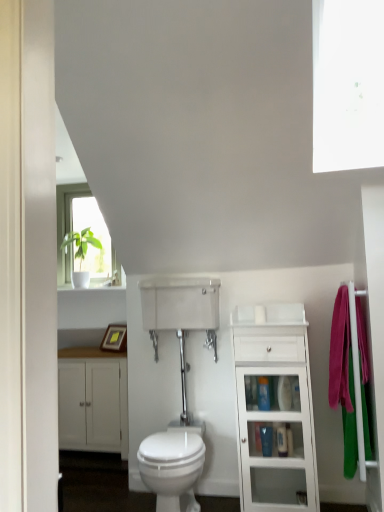
This screenshot has height=512, width=384. What do you see at coordinates (266, 440) in the screenshot?
I see `blue plastic bottle at center, the 2th toiletry viewed from the top` at bounding box center [266, 440].

What do you see at coordinates (348, 84) in the screenshot? This screenshot has height=512, width=384. I see `transparent glass window screen at upper right` at bounding box center [348, 84].

I want to click on white glossy medicine cabinet at center, so click(x=180, y=303).

What do you see at coordinates (172, 467) in the screenshot?
I see `white glossy bidet at center` at bounding box center [172, 467].

Image resolution: width=384 pixels, height=512 pixels. What do you see at coordinates (93, 400) in the screenshot? I see `white matte cabinet at lower left, placed as the 2th bathroom cabinet when sorted from front to back` at bounding box center [93, 400].

Identify the location of blue plastic bottle at center, the 2th toiletry viewed from the top. Image resolution: width=384 pixels, height=512 pixels. (266, 440).

Is point (332, 357) closer to viewer compared to point (173, 498)?

No, it is not.

From the image's perspective, which one is positioned lower, pink fabric towel at right or white glossy bidet at center?

white glossy bidet at center, from the image's perspective.

Could you tell me if pink fabric towel at right is turned towards white glossy bidet at center?

Yes, pink fabric towel at right is turned towards white glossy bidet at center.

From a real-world perspective, between blue plastic bottle at center, which is the first toiletry from bottom to top, and white glossy medicine cabinet at center, who is vertically higher?

white glossy medicine cabinet at center, from a real-world perspective.

Considering the sizes of objects blue plastic bottle at center, which is the first toiletry from bottom to top, and white glossy medicine cabinet at center in the image provided, who is smaller, blue plastic bottle at center, which is the first toiletry from bottom to top, or white glossy medicine cabinet at center?

blue plastic bottle at center, which is the first toiletry from bottom to top, is smaller.

Locate an element on the screen. The height and width of the screenshot is (512, 384). medicine cabinet behind the blue plastic bottle at center, the third toiletry from the top is located at coordinates (180, 303).

Can you confirm if blue plastic bottle at center, which is the first toiletry from bottom to top, is wider than white glossy medicine cabinet at center?

In fact, blue plastic bottle at center, which is the first toiletry from bottom to top, might be narrower than white glossy medicine cabinet at center.

Does blue plastic bottle at center, the third toiletry from the top, have a lesser width compared to white glossy cabinet at right, the first bathroom cabinet in the front-to-back sequence?

Indeed, blue plastic bottle at center, the third toiletry from the top, has a lesser width compared to white glossy cabinet at right, the first bathroom cabinet in the front-to-back sequence.

This screenshot has height=512, width=384. What are the coordinates of `bathroom cabinet in front of the blue plastic bottle at center, the third toiletry from the top` in the screenshot? It's located at (x=274, y=408).

Is white glossy cabinet at right, which is the 2th bathroom cabinet in back-to-front order, a part of blue plastic bottle at center, the third toiletry from the top?

Definitely not — white glossy cabinet at right, which is the 2th bathroom cabinet in back-to-front order, is not inside blue plastic bottle at center, the third toiletry from the top.

Between point (286, 439) and point (290, 403), which one is positioned in front?

The point (290, 403) is closer to the camera.

Measure the distance from blue glossy toiletry at center, which appears as the 1th toiletry when viewed from the top, to pink fabric towel at right.

A distance of 48.05 centimeters exists between blue glossy toiletry at center, which appears as the 1th toiletry when viewed from the top, and pink fabric towel at right.

Consider the image. From a real-world perspective, is blue glossy toiletry at center, which is counted as the third toiletry, starting from the bottom, positioned above or below pink fabric towel at right?

Clearly, from a real-world perspective, blue glossy toiletry at center, which is counted as the third toiletry, starting from the bottom, is below pink fabric towel at right.

Identify the location of toiletry that is the 1st one when counting downward from the pink fabric towel at right (from the image's perspective). (263, 393).

Which of these two, blue glossy toiletry at center, which is counted as the third toiletry, starting from the bottom, or pink fabric towel at right, is wider?

pink fabric towel at right.

Would you say transparent glass window screen at upper right is inside or outside blue plastic bottle at center, the third toiletry from the top?

transparent glass window screen at upper right is spatially situated outside blue plastic bottle at center, the third toiletry from the top.

From a real-world perspective, who is located lower, transparent glass window screen at upper right or blue plastic bottle at center, which is the first toiletry from bottom to top?

blue plastic bottle at center, which is the first toiletry from bottom to top.

Looking at this image, is transparent glass window screen at upper right at the left side of blue plastic bottle at center, the third toiletry from the top?

No, transparent glass window screen at upper right is not to the left of blue plastic bottle at center, the third toiletry from the top.

Is transparent glass window screen at upper right oriented away from blue plastic bottle at center, the third toiletry from the top?

No, transparent glass window screen at upper right is not facing the opposite direction of blue plastic bottle at center, the third toiletry from the top.

From a real-world perspective, is white glossy medicine cabinet at center above or below white glossy cabinet at right, which is the 2th bathroom cabinet in back-to-front order?

Clearly, from a real-world perspective, white glossy medicine cabinet at center is above white glossy cabinet at right, which is the 2th bathroom cabinet in back-to-front order.

Can you tell me how much white glossy medicine cabinet at center and white glossy cabinet at right, which appears as the second bathroom cabinet when viewed from the left, differ in facing direction?

There is a 1.55-degree angle between the facing directions of white glossy medicine cabinet at center and white glossy cabinet at right, which appears as the second bathroom cabinet when viewed from the left.

How much distance is there between white glossy medicine cabinet at center and white glossy cabinet at right, which appears as the second bathroom cabinet when viewed from the left?

21.25 inches.

From the image's perspective, does white glossy medicine cabinet at center appear lower than white glossy cabinet at right, the first bathroom cabinet in the front-to-back sequence?

Incorrect, from the image's perspective, white glossy medicine cabinet at center is higher than white glossy cabinet at right, the first bathroom cabinet in the front-to-back sequence.

Which object is more forward, white matte cabinet at lower left, placed as the second bathroom cabinet when sorted from right to left, or white glossy cabinet at right, which appears as the second bathroom cabinet when viewed from the left?

white glossy cabinet at right, which appears as the second bathroom cabinet when viewed from the left, is more forward.

Considering the relative sizes of white matte cabinet at lower left, placed as the 2th bathroom cabinet when sorted from front to back, and white glossy cabinet at right, which is the 2th bathroom cabinet in back-to-front order, in the image provided, is white matte cabinet at lower left, placed as the 2th bathroom cabinet when sorted from front to back, wider than white glossy cabinet at right, which is the 2th bathroom cabinet in back-to-front order,?

No.

How different are the orientations of white matte cabinet at lower left, which appears as the 1th bathroom cabinet when viewed from the left, and white glossy cabinet at right, which is the 2th bathroom cabinet in back-to-front order, in degrees?

The angular difference between white matte cabinet at lower left, which appears as the 1th bathroom cabinet when viewed from the left, and white glossy cabinet at right, which is the 2th bathroom cabinet in back-to-front order, is 0.531 degrees.

In order to click on bathroom cabinet on the right of white matte cabinet at lower left, placed as the second bathroom cabinet when sorted from right to left in this screenshot , I will do `click(274, 408)`.

In the image, there is a pink fabric towel at right. Identify the location of bidet below it (from a real-world perspective). (172, 467).

The width and height of the screenshot is (384, 512). I want to click on medicine cabinet behind the blue plastic bottle at center, the third toiletry from the top, so (180, 303).

From the image, which object appears to be farther from white glossy cabinet at right, which is the 2th bathroom cabinet in back-to-front order, blue glossy toiletry at center, which appears as the 1th toiletry when viewed from the top, or white glossy medicine cabinet at center?

white glossy medicine cabinet at center is further to white glossy cabinet at right, which is the 2th bathroom cabinet in back-to-front order.

Which object lies nearer to the anchor point white glossy cabinet at right, the first bathroom cabinet in the front-to-back sequence, white glossy bidet at center or white glossy medicine cabinet at center?

white glossy bidet at center is positioned closer to the anchor white glossy cabinet at right, the first bathroom cabinet in the front-to-back sequence.

Looking at the image, which one is located closer to white glossy bidet at center, blue plastic bottle at center, which is the first toiletry from bottom to top, or blue plastic bottle at center, the second toiletry positioned from the bottom?

blue plastic bottle at center, the second toiletry positioned from the bottom.

From the image, which object appears to be nearer to blue glossy toiletry at center, which appears as the 1th toiletry when viewed from the top, white matte cabinet at lower left, placed as the 2th bathroom cabinet when sorted from front to back, or white glossy medicine cabinet at center?

white glossy medicine cabinet at center is positioned closer to the anchor blue glossy toiletry at center, which appears as the 1th toiletry when viewed from the top.

Considering their positions, is white glossy bidet at center positioned further to white glossy medicine cabinet at center than pink fabric towel at right?

Based on the image, pink fabric towel at right appears to be further to white glossy medicine cabinet at center.

Consider the image. Estimate the real-world distances between objects in this image. Which object is closer to transparent glass window screen at upper right, pink fabric towel at right or blue plastic bottle at center, which is the first toiletry from bottom to top?

pink fabric towel at right is closer to transparent glass window screen at upper right.

When comparing their distances from white glossy medicine cabinet at center, does white glossy cabinet at right, acting as the 1th bathroom cabinet starting from the right, or blue plastic bottle at center, the third toiletry from the top, seem further?

Based on the image, blue plastic bottle at center, the third toiletry from the top, appears to be further to white glossy medicine cabinet at center.

From the image, which object appears to be farther from white matte cabinet at lower left, placed as the second bathroom cabinet when sorted from right to left, pink fabric towel at right or white glossy cabinet at right, which is the 2th bathroom cabinet in back-to-front order?

pink fabric towel at right is further to white matte cabinet at lower left, placed as the second bathroom cabinet when sorted from right to left.

Find the location of `bidet between white matte cabinet at lower left, placed as the 2th bathroom cabinet when sorted from front to back, and white glossy cabinet at right, acting as the 1th bathroom cabinet starting from the right`. bidet between white matte cabinet at lower left, placed as the 2th bathroom cabinet when sorted from front to back, and white glossy cabinet at right, acting as the 1th bathroom cabinet starting from the right is located at coordinates (172, 467).

Where is `bathroom cabinet that lies between blue glossy toiletry at center, which is counted as the third toiletry, starting from the bottom, and blue plastic bottle at center, the second toiletry positioned from the bottom, from top to bottom`? This screenshot has width=384, height=512. bathroom cabinet that lies between blue glossy toiletry at center, which is counted as the third toiletry, starting from the bottom, and blue plastic bottle at center, the second toiletry positioned from the bottom, from top to bottom is located at coordinates pos(274,408).

What are the coordinates of `bath towel between transparent glass window screen at upper right and white glossy cabinet at right, which is the 2th bathroom cabinet in back-to-front order, in the up-down direction` in the screenshot? It's located at (343, 378).

Locate an element on the screen. The image size is (384, 512). bathroom cabinet situated between white glossy bidet at center and blue plastic bottle at center, the third toiletry from the top, from left to right is located at coordinates coord(274,408).